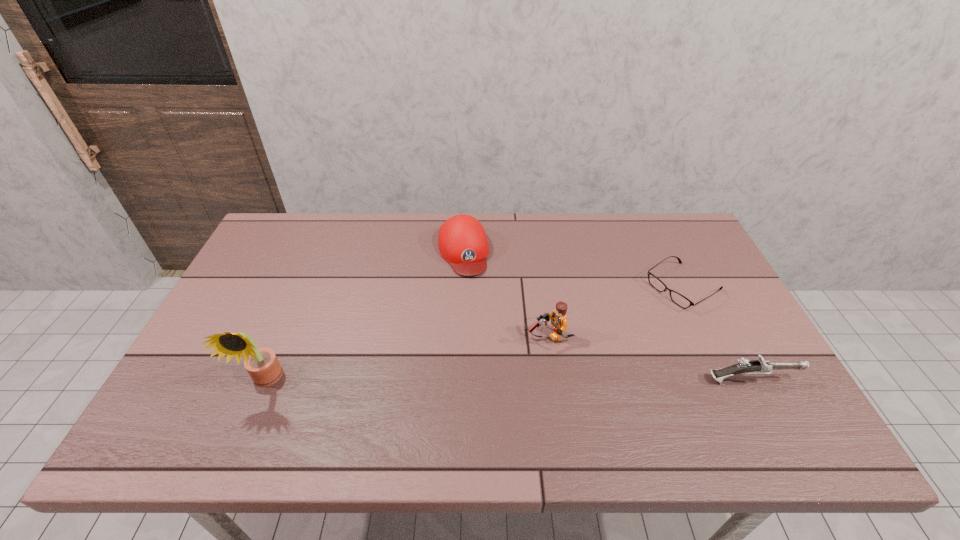
The height and width of the screenshot is (540, 960). What are the coordinates of `vacant region located 0.110m holding a crossbow in the hands of the third nearest object` in the screenshot? It's located at (492, 360).

You are a GUI agent. You are given a task and a screenshot of the screen. Output one action in this format:
    pyautogui.click(x=<x>, y=<y>)
    Task: Click on the vacant area located holding a crossbow in the hands of the third nearest object
    This screenshot has width=960, height=540.
    Given the screenshot: What is the action you would take?
    pyautogui.click(x=462, y=375)

At what (x,y) coordinates should I click in order to perform the action: click on vacant position located holding a crossbow in the hands of the third nearest object. Please return your answer as a coordinate pair (x, y). This screenshot has height=540, width=960. Looking at the image, I should click on (479, 366).

I want to click on free point located 0.210m on the front-facing side of the baseball cap, so click(485, 329).

The height and width of the screenshot is (540, 960). I want to click on vacant region located 0.260m on the front-facing side of the baseball cap, so click(489, 343).

Where is `free location located 0.240m on the front-facing side of the baseball cap`? Image resolution: width=960 pixels, height=540 pixels. free location located 0.240m on the front-facing side of the baseball cap is located at coordinates (487, 338).

Where is `object present at the far edge`? The image size is (960, 540). object present at the far edge is located at coordinates (462, 241).

Identify the location of sunflower present at the near edge. This screenshot has width=960, height=540. (262, 364).

This screenshot has width=960, height=540. What are the coordinates of `gun situated at the near edge` in the screenshot? It's located at (760, 366).

Locate an element on the screen. This screenshot has width=960, height=540. object present at the left edge is located at coordinates (262, 364).